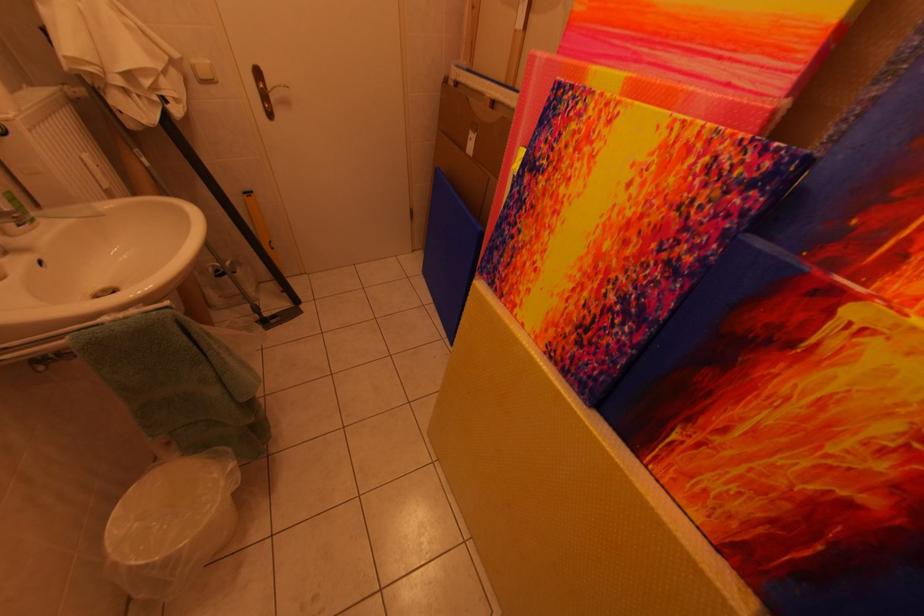
This screenshot has height=616, width=924. Identify the location of sink faucet handle. (7, 214).